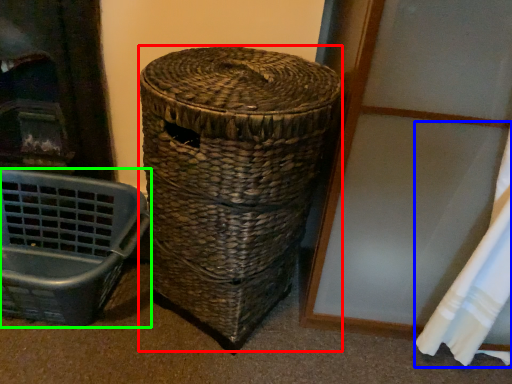
Question: Which object is positioned closest to basket (highlighted by a red box)? Select from curtain (highlighted by a blue box) and furniture (highlighted by a green box).

Choices:
 (A) curtain
 (B) furniture

Answer: (B)